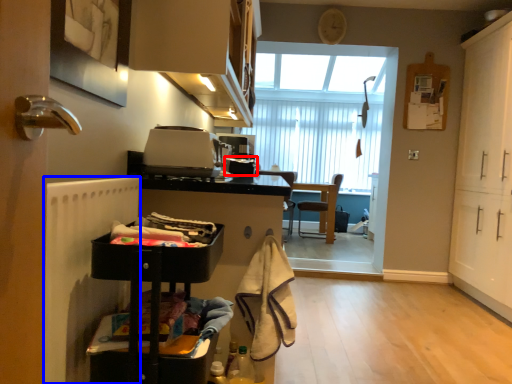
Question: Among these objects, which one is nearest to the camera, appliance (highlighted by a red box) or radiator (highlighted by a blue box)?

Choices:
 (A) appliance
 (B) radiator

Answer: (B)